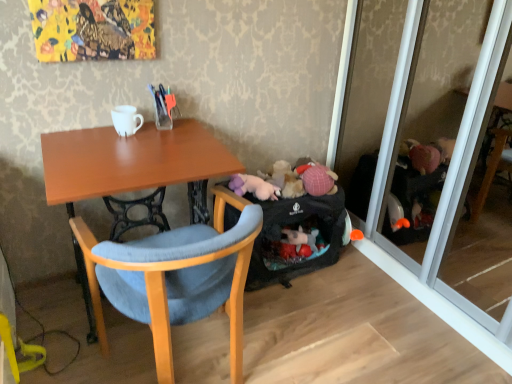
This screenshot has height=384, width=512. In order to click on vacant space situated on the left part of transparent glass screen door at right in this screenshot , I will do `click(331, 305)`.